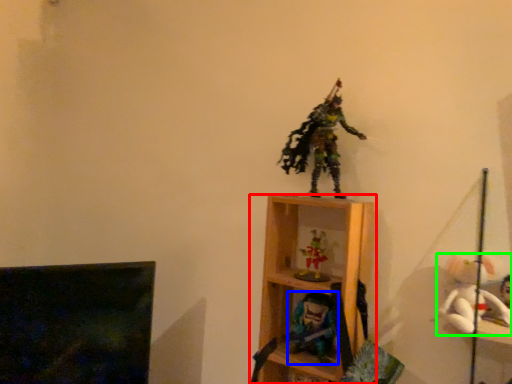
Question: Estimate the real-world distances between objects in this image. Which object is farther from shelf (highlighted by a red box), toy (highlighted by a blue box) or toy (highlighted by a green box)?

Choices:
 (A) toy
 (B) toy

Answer: (B)